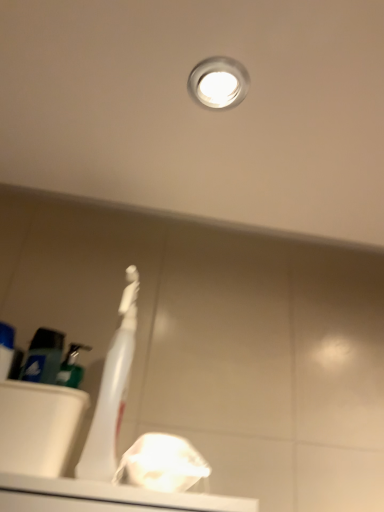
Question: Choose the correct answer: Is white plastic toothbrush at center inside white glossy droplight at upper center or outside it?

Choices:
 (A) inside
 (B) outside

Answer: (B)

Question: Looking at their shapes, would you say white plastic toothbrush at center is wider or thinner than white glossy droplight at upper center?

Choices:
 (A) thin
 (B) wide

Answer: (B)

Question: Based on their relative distances, which object is farther from the white glossy droplight at upper center?

Choices:
 (A) white plastic toothbrush at center
 (B) white plastic sink at lower left
 (C) blue matte toothpaste tube at left

Answer: (C)

Question: Which object is the closest to the white plastic sink at lower left?

Choices:
 (A) white plastic toothbrush at center
 (B) white glossy droplight at upper center
 (C) blue matte toothpaste tube at left

Answer: (C)